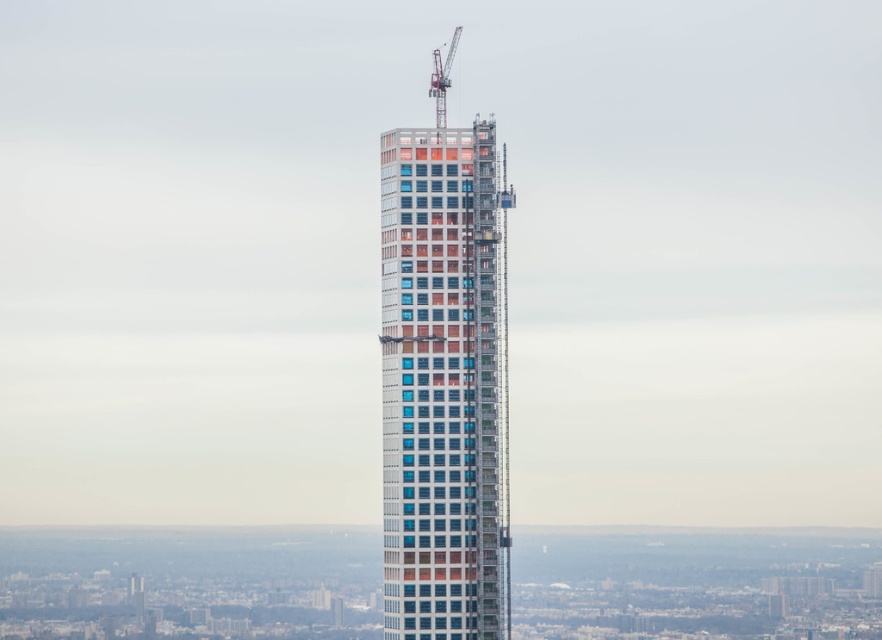
Question: Is brick-like textured building at center wider than metallic gray crane at top?

Choices:
 (A) no
 (B) yes

Answer: (B)

Question: Can you confirm if brick-like textured building at center is positioned above metallic gray crane at top?

Choices:
 (A) no
 (B) yes

Answer: (A)

Question: Which point is farther from the camera taking this photo?

Choices:
 (A) (498, 538)
 (B) (441, 108)

Answer: (A)

Question: From the image, what is the correct spatial relationship of brick-like textured building at center in relation to metallic gray crane at top?

Choices:
 (A) right
 (B) left

Answer: (A)